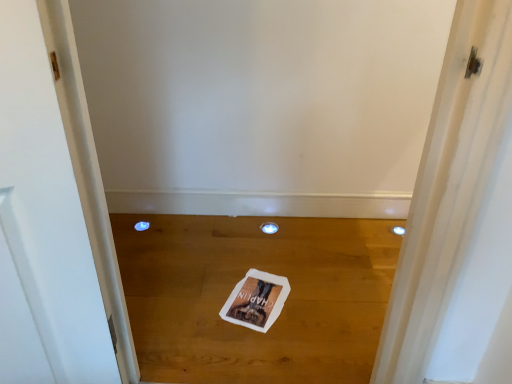
Question: Would you say white paper at center is to the left or to the right of white paper magazine at center in the picture?

Choices:
 (A) right
 (B) left

Answer: (B)

Question: From the image's perspective, is white paper at center located above or below white paper magazine at center?

Choices:
 (A) below
 (B) above

Answer: (B)

Question: Based on their relative distances, which object is nearer to the white paper magazine at center?

Choices:
 (A) blue plastic hole at lower left, the first hole viewed from the left
 (B) white paper at center
 (C) transparent plastic hole at center, which is the 2th hole from left to right

Answer: (B)

Question: Estimate the real-world distances between objects in this image. Which object is closer to the white paper at center?

Choices:
 (A) white paper magazine at center
 (B) transparent plastic hole at center, acting as the first hole starting from the right
 (C) blue plastic hole at lower left, the first hole viewed from the left

Answer: (A)